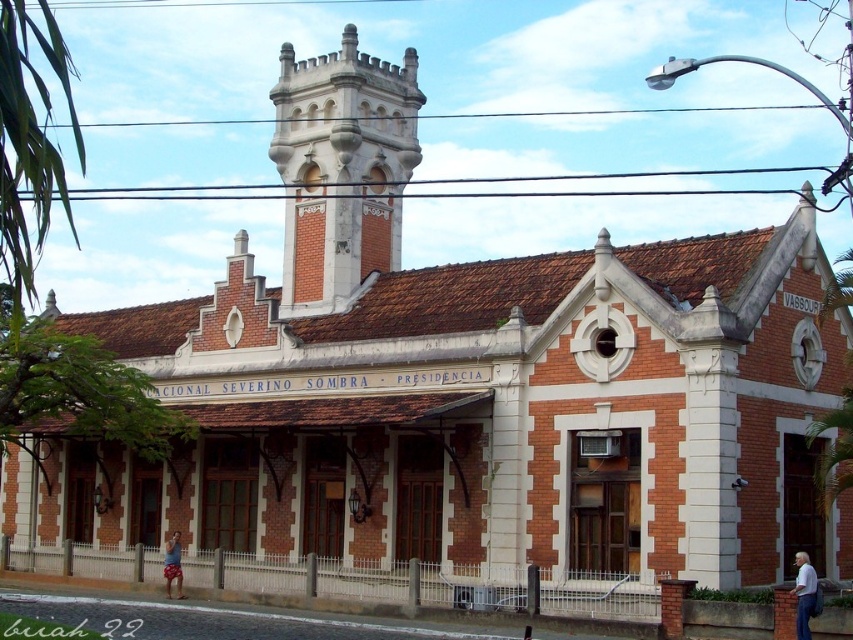
Question: Is white cotton shirt at lower right wider than beige shorts at lower left?

Choices:
 (A) no
 (B) yes

Answer: (B)

Question: Which object is closer to the camera taking this photo?

Choices:
 (A) white cotton shirt at lower right
 (B) red brick bell tower at upper center
 (C) beige shorts at lower left

Answer: (A)

Question: Which point is closer to the camera taking this photo?

Choices:
 (A) (392, 104)
 (B) (177, 579)
 (C) (811, 611)

Answer: (C)

Question: Does white cotton shirt at lower right appear on the right side of beige shorts at lower left?

Choices:
 (A) yes
 (B) no

Answer: (A)

Question: Can you confirm if red brick bell tower at upper center is wider than white cotton shirt at lower right?

Choices:
 (A) yes
 (B) no

Answer: (A)

Question: Which object is farther from the camera taking this photo?

Choices:
 (A) beige shorts at lower left
 (B) white cotton shirt at lower right
 (C) red brick bell tower at upper center

Answer: (C)